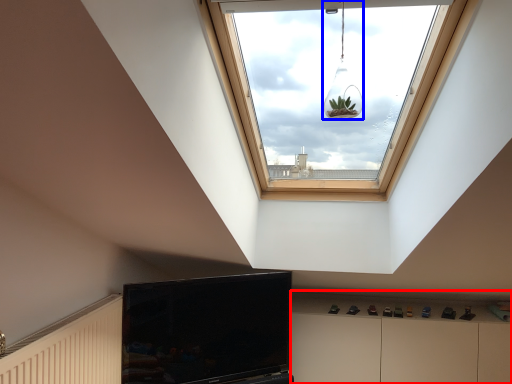
Question: Which point is further to the camera, dresser (highlighted by a red box) or light fixture (highlighted by a blue box)?

Choices:
 (A) dresser
 (B) light fixture

Answer: (A)